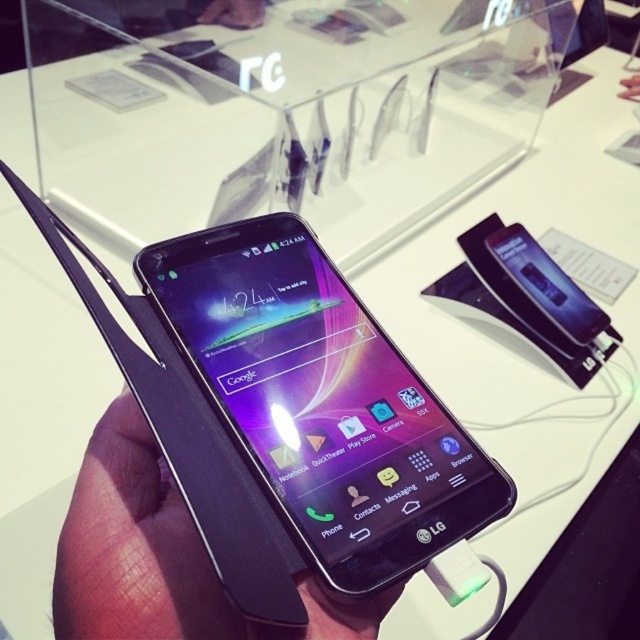
Question: Is black glossy phone at center behind black matte phone at center?

Choices:
 (A) no
 (B) yes

Answer: (B)

Question: From the image, what is the correct spatial relationship of black glossy phone at center in relation to black matte phone at center?

Choices:
 (A) right
 (B) left

Answer: (A)

Question: Which point is farther to the camera?

Choices:
 (A) black glossy phone at center
 (B) black matte phone at center

Answer: (A)

Question: Does black glossy phone at center appear under black matte phone at center?

Choices:
 (A) no
 (B) yes

Answer: (A)

Question: Which of the following is the closest to the observer?

Choices:
 (A) (221, 333)
 (B) (150, 513)

Answer: (B)

Question: Which object appears farthest from the camera in this image?

Choices:
 (A) black matte phone at center
 (B) black glossy phone at center

Answer: (B)